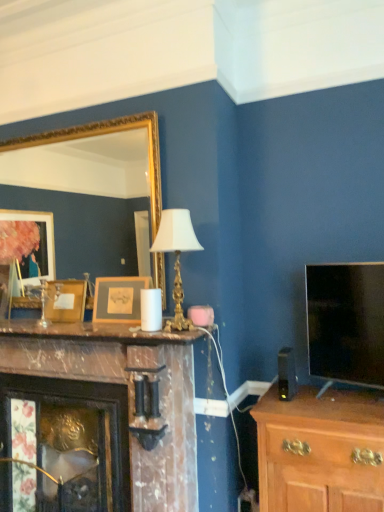
Identify the location of free space above gold-framed mirror at upper left (from a real-world perspective). Image resolution: width=384 pixels, height=512 pixels. (71, 124).